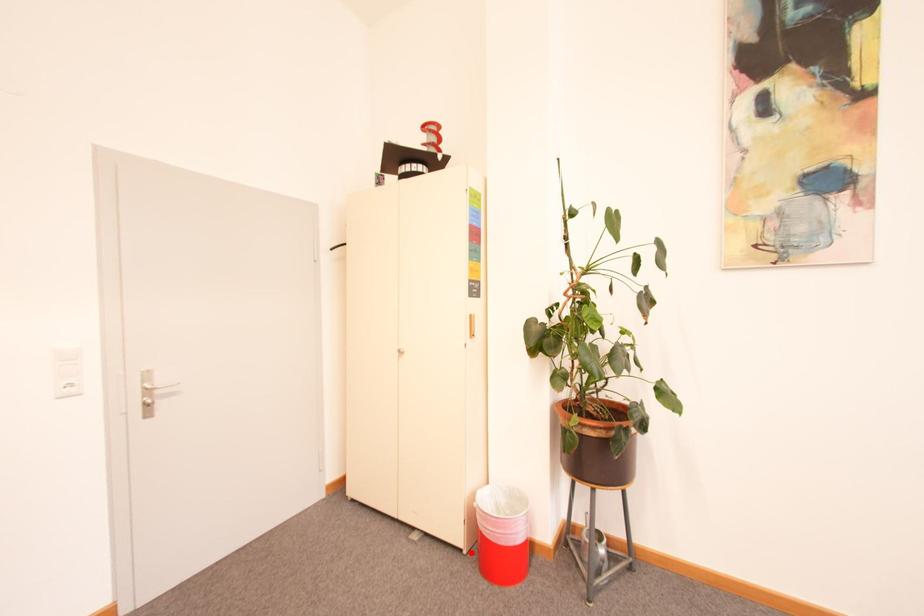
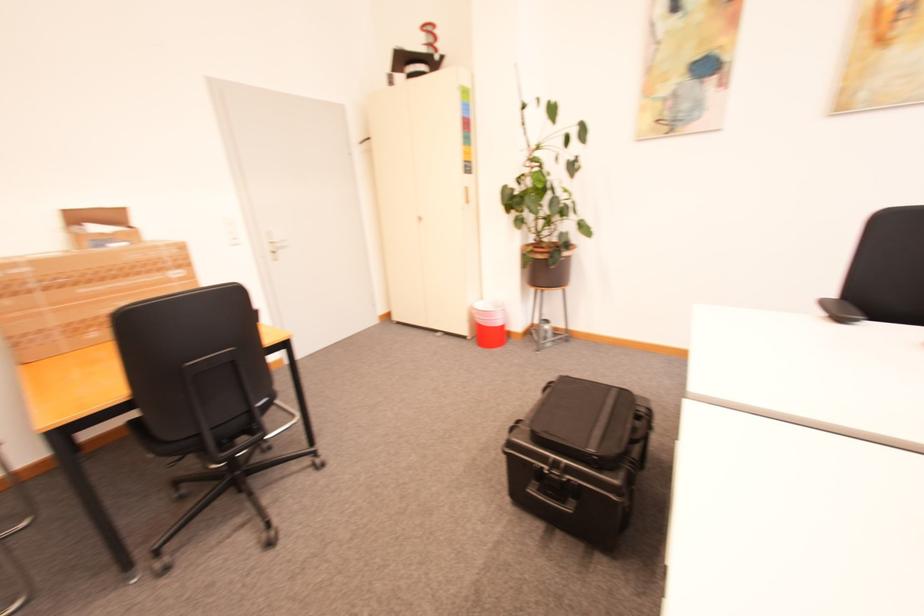
Locate, in the second image, the point that corresponds to the highlighted location in the first image.

(476, 339)